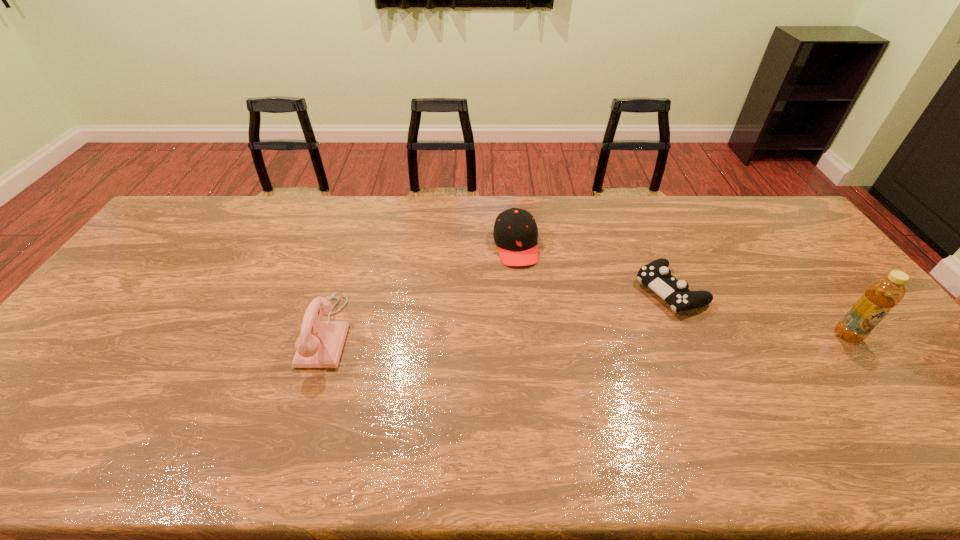
Locate an element on the screen. This screenshot has height=540, width=960. telephone is located at coordinates (319, 345).

Identify the location of the third shortest object. This screenshot has width=960, height=540. (319, 345).

The height and width of the screenshot is (540, 960). I want to click on bottle, so click(x=884, y=293).

Identify the location of the tallest object. Image resolution: width=960 pixels, height=540 pixels. (884, 293).

Find the location of a particular element. The height and width of the screenshot is (540, 960). cap is located at coordinates (515, 233).

At what (x,y) coordinates should I click in order to perform the action: click on the second shortest object. Please return your answer as a coordinate pair (x, y). This screenshot has height=540, width=960. Looking at the image, I should click on (515, 233).

Locate an element on the screen. the second object from right to left is located at coordinates (656, 275).

I want to click on control, so click(656, 275).

Where is `free spot located 0.230m on the dial of the telephone`? The image size is (960, 540). free spot located 0.230m on the dial of the telephone is located at coordinates (220, 332).

The height and width of the screenshot is (540, 960). I want to click on vacant space located on the dial of the telephone, so click(x=198, y=332).